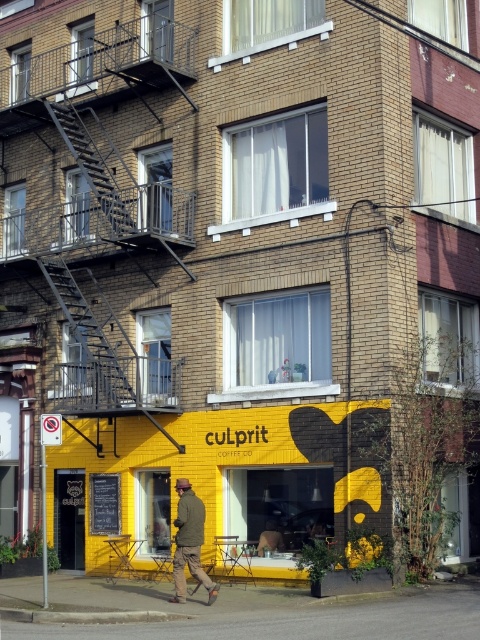
In the scene shown: Can you confirm if gray asphalt pavement at lower center is positioned above camouflage jacket at center?

No.

Is point (323, 634) farther from camera compared to point (206, 589)?

No, it is not.

The image size is (480, 640). I want to click on gray asphalt pavement at lower center, so click(259, 612).

Is point (93, 346) closer to camera compared to point (187, 515)?

No.

Is black metal fire escape at upper left positioned behind camouflage jacket at center?

Yes, black metal fire escape at upper left is further from the viewer.

Is point (83, 266) less distant than point (194, 536)?

No, it is not.

Locate an element on the screen. black metal fire escape at upper left is located at coordinates point(94,198).

Can you confirm if black metal fire escape at upper left is wider than gray asphalt pavement at lower center?

No, black metal fire escape at upper left is not wider than gray asphalt pavement at lower center.

Who is shorter, black metal fire escape at upper left or gray asphalt pavement at lower center?

With less height is gray asphalt pavement at lower center.

Who is more forward, (x=103, y=147) or (x=307, y=600)?

Point (x=307, y=600)

Find the location of `black metal fire escape at upper left`. black metal fire escape at upper left is located at coordinates (94, 198).